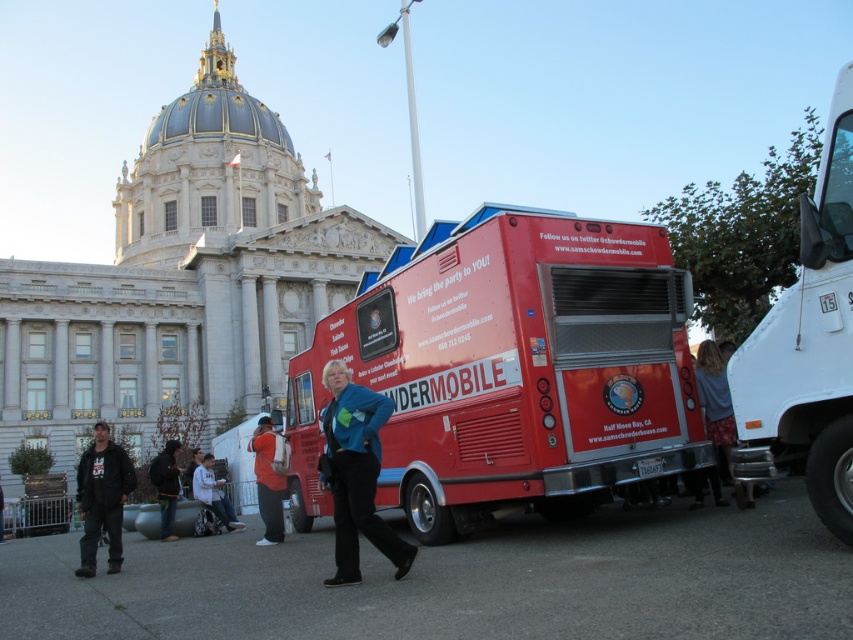
Based on the photo, is white glossy truck at right wider than dark gray jacket at lower left?

In fact, white glossy truck at right might be narrower than dark gray jacket at lower left.

Looking at this image, does white glossy truck at right appear on the right side of dark gray jacket at lower left?

Correct, you'll find white glossy truck at right to the right of dark gray jacket at lower left.

This screenshot has width=853, height=640. I want to click on white glossy truck at right, so click(x=807, y=346).

Who is taller, blue fabric jacket at center or dark gray jacket at lower left?

dark gray jacket at lower left is taller.

Can you confirm if blue fabric jacket at center is bigger than dark gray jacket at lower left?

Incorrect, blue fabric jacket at center is not larger than dark gray jacket at lower left.

Between point (363, 429) and point (102, 470), which one is positioned behind?

Positioned behind is point (102, 470).

Find the location of a particular element. Image resolution: width=853 pixels, height=640 pixels. blue fabric jacket at center is located at coordinates (357, 474).

You are a GUI agent. You are given a task and a screenshot of the screen. Output one action in this format:
    pyautogui.click(x=<x>, y=<y>)
    Task: Click on the white glossy truck at right
    The image size is (853, 640).
    Given the screenshot: What is the action you would take?
    pyautogui.click(x=807, y=346)

Is the position of white glossy truck at right less distant than that of blue denim jeans at lower right?

Yes, it is in front of blue denim jeans at lower right.

Describe the element at coordinates (807, 346) in the screenshot. I see `white glossy truck at right` at that location.

Find the location of `white glossy truck at right`. white glossy truck at right is located at coordinates (807, 346).